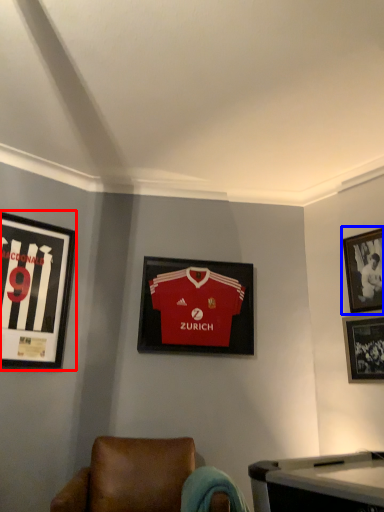
Question: Which of the following is the closest to the observer, picture frame (highlighted by a red box) or picture frame (highlighted by a blue box)?

Choices:
 (A) picture frame
 (B) picture frame

Answer: (A)